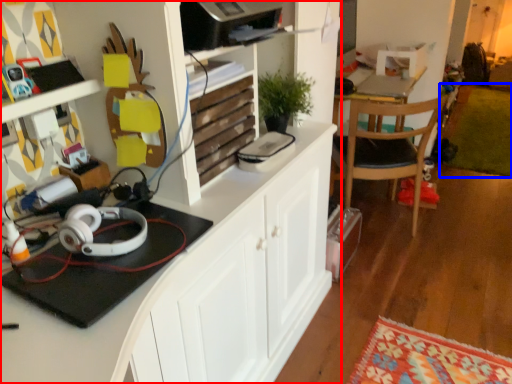
Question: Which point is closer to the camera, cabinetry (highlighted by a red box) or mat (highlighted by a blue box)?

Choices:
 (A) cabinetry
 (B) mat

Answer: (A)